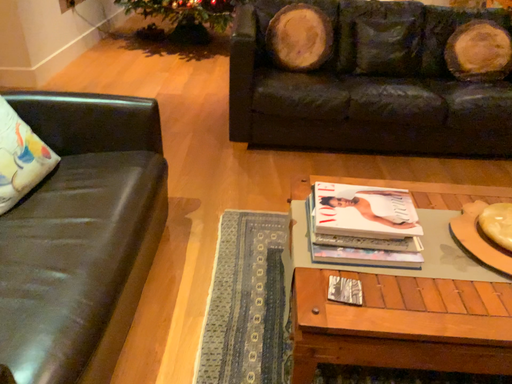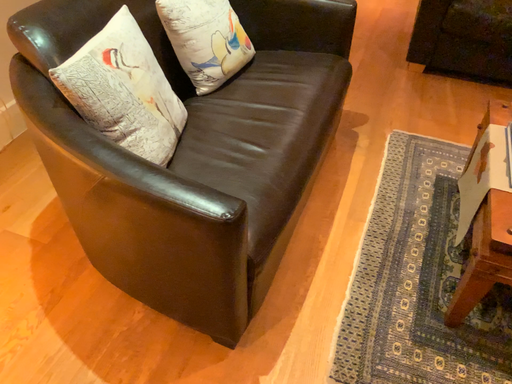
Question: How did the camera likely rotate when shooting the video?

Choices:
 (A) rotated downward
 (B) rotated upward

Answer: (A)